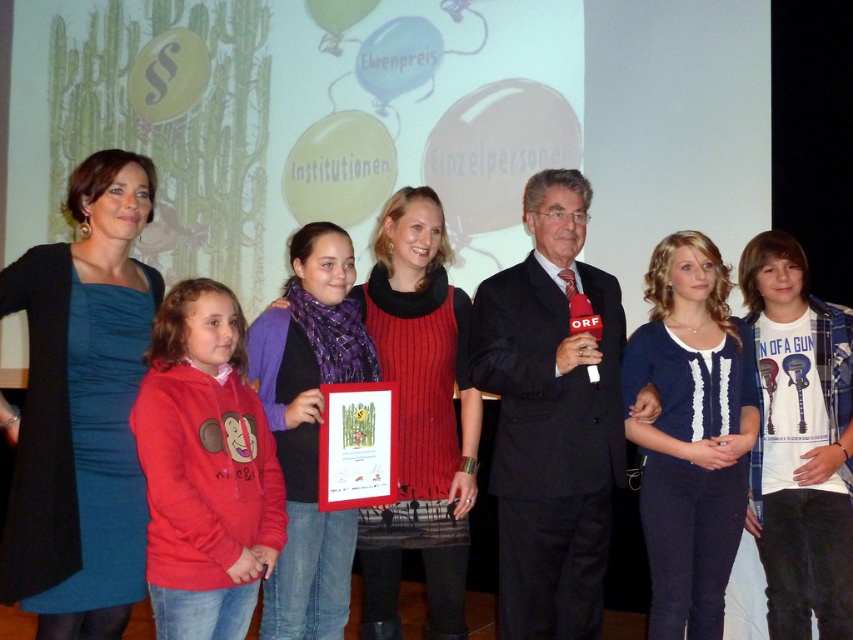
Question: Which point is farther from the camera taking this photo?

Choices:
 (A) (567, 172)
 (B) (57, 522)

Answer: (A)

Question: Which object is positioned farthest from the matte red sweater at center?

Choices:
 (A) red fleece sweatshirt at left
 (B) teal satin dress at center

Answer: (B)

Question: Which of the following is the farthest from the observer?

Choices:
 (A) red fleece sweatshirt at left
 (B) purple knitwear at center
 (C) teal satin dress at center
 (D) matte red sweater at center

Answer: (D)

Question: Can you confirm if black suit at center is positioned to the left of red fleece sweatshirt at left?

Choices:
 (A) yes
 (B) no

Answer: (B)

Question: Does teal satin dress at center appear on the right side of black suit at center?

Choices:
 (A) no
 (B) yes

Answer: (A)

Question: Is black suit at center below blue knit sweater at center?

Choices:
 (A) yes
 (B) no

Answer: (B)